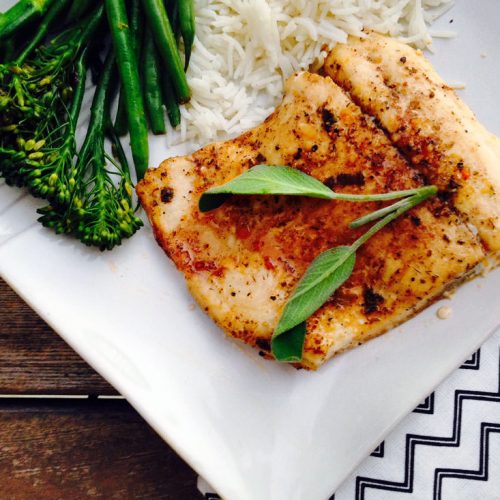
Identify the location of the top right corner of white plate. (493, 11).